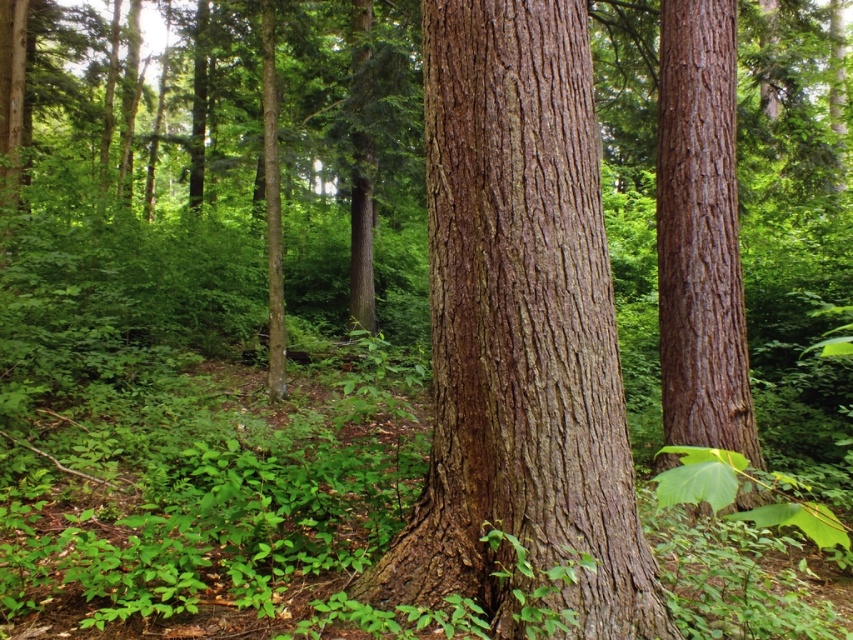
Where is `brown rough bark tree trunk at center`? Image resolution: width=853 pixels, height=640 pixels. brown rough bark tree trunk at center is located at coordinates (520, 332).

Consider the image. Between brown rough bark tree trunk at center and smooth brown bark at center, which one appears on the right side from the viewer's perspective?

Positioned to the right is smooth brown bark at center.

In order to click on brown rough bark tree trunk at center in this screenshot , I will do `click(520, 332)`.

Where is `brown rough bark tree trunk at center`? Image resolution: width=853 pixels, height=640 pixels. brown rough bark tree trunk at center is located at coordinates (520, 332).